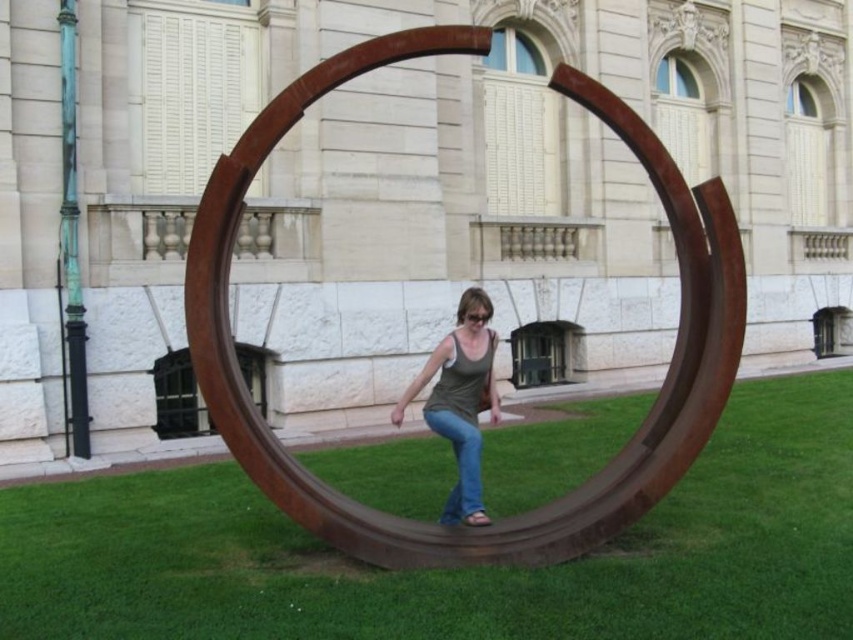
You are a fashion designer observing a model wearing a matte gray tank top at center and jeans at center. Which piece of clothing is positioned higher on the model?

The matte gray tank top at center is positioned higher on the model than the jeans at center because it is above it.

You are standing in front of the sculpture and want to take a photo of the matte gray tank top at center and jeans at center. Which object should you focus on first if you want to ensure both are in the frame without moving the camera?

You should focus on the matte gray tank top at center first because it is taller than the jeans at center, ensuring it fits within the frame while capturing both objects.

You are at a park and see a person wearing a matte gray tank top at center and jeans at center. Which clothing item is more to the left?

The matte gray tank top at center is positioned on the left side of jeans at center, so the matte gray tank top at center is more to the left.